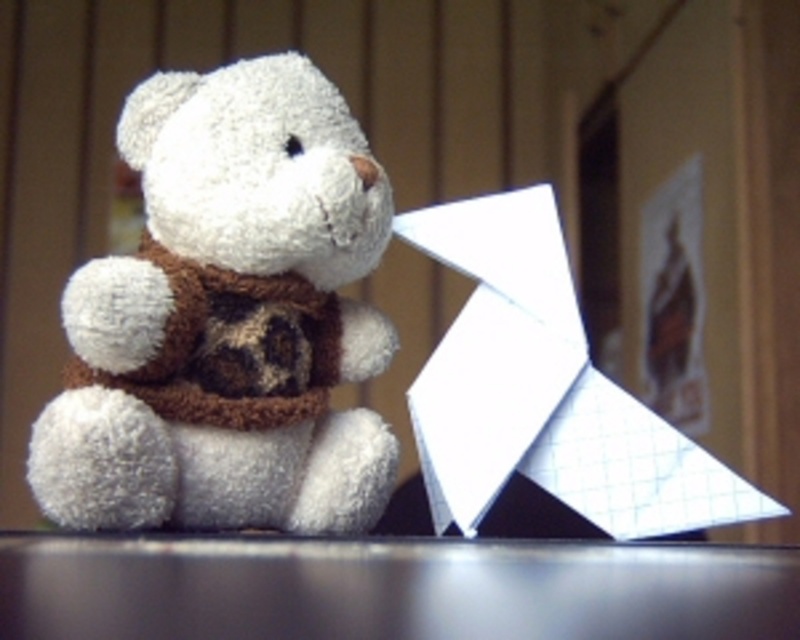
Question: Which of these objects is positioned farthest from the black glossy table at lower center?

Choices:
 (A) white plush teddy bear at center
 (B) white paper at right

Answer: (B)

Question: Does white plush teddy bear at center appear over white paper at right?

Choices:
 (A) yes
 (B) no

Answer: (A)

Question: Does white plush teddy bear at center have a greater width compared to black glossy table at lower center?

Choices:
 (A) yes
 (B) no

Answer: (B)

Question: Among these points, which one is nearest to the camera?

Choices:
 (A) (260, 419)
 (B) (425, 225)
 (C) (424, 561)

Answer: (C)

Question: Is white plush teddy bear at center positioned before white paper at right?

Choices:
 (A) no
 (B) yes

Answer: (B)

Question: Estimate the real-world distances between objects in this image. Which object is farther from the white plush teddy bear at center?

Choices:
 (A) white paper at right
 (B) black glossy table at lower center

Answer: (B)